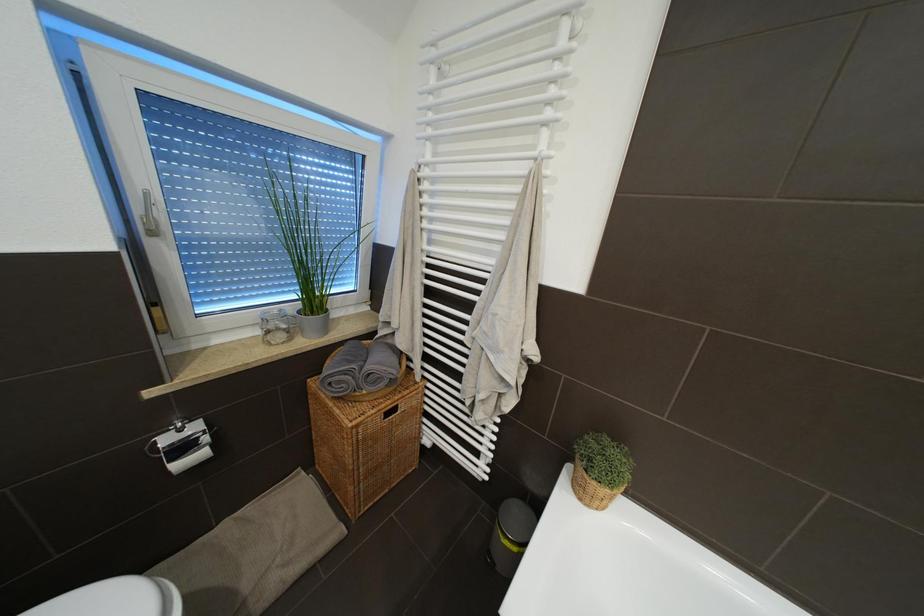
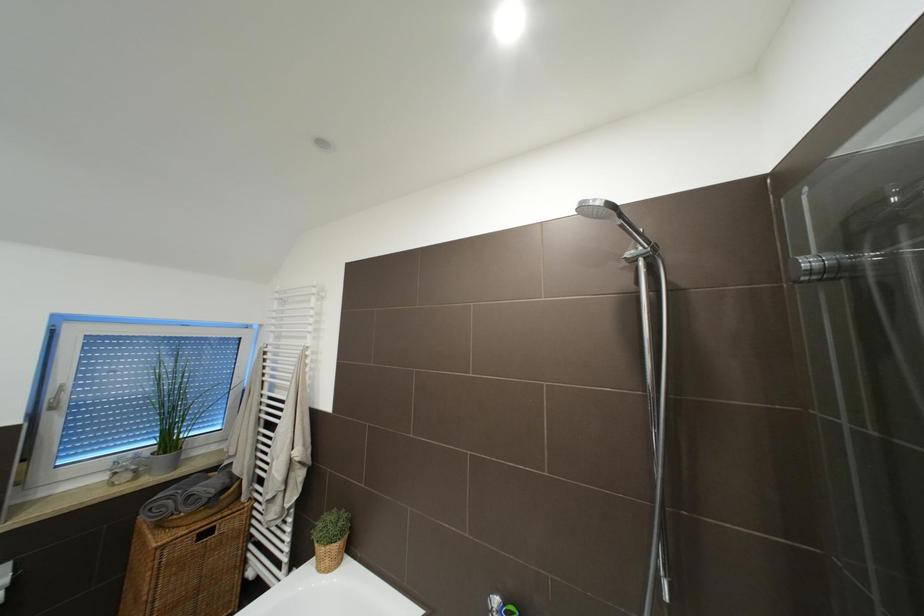
What movement of the cameraman would produce the second image?

The cameraman walked toward right, backward.